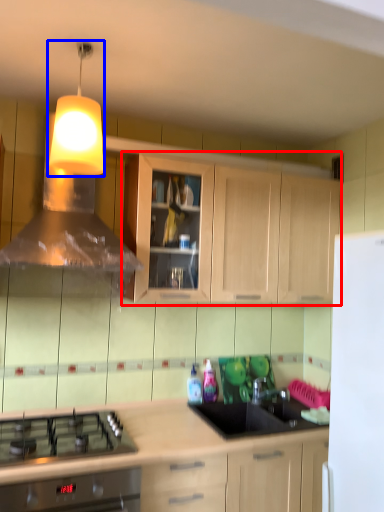
Question: Among these objects, which one is farthest to the camera, cabinetry (highlighted by a red box) or light fixture (highlighted by a blue box)?

Choices:
 (A) cabinetry
 (B) light fixture

Answer: (A)